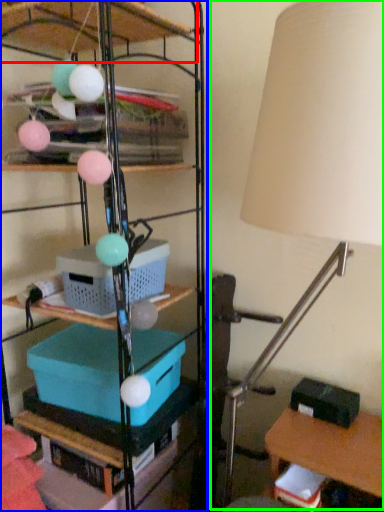
Question: Considering the real-world distances, which object is farthest from shelf (highlighted by a red box)? shelf (highlighted by a blue box) or lamp (highlighted by a green box)?

Choices:
 (A) shelf
 (B) lamp

Answer: (B)